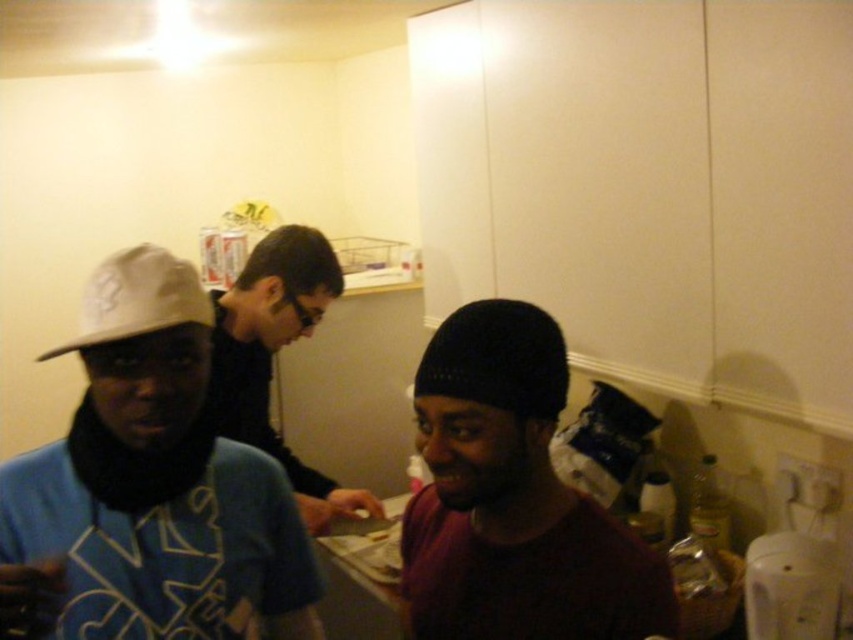
Is dark knit cap at center smaller than black matte shirt at center?

Yes.

The image size is (853, 640). What do you see at coordinates (512, 499) in the screenshot? I see `dark knit cap at center` at bounding box center [512, 499].

Locate an element on the screen. The image size is (853, 640). dark knit cap at center is located at coordinates (512, 499).

Is dark knit cap at center positioned behind white matte baseball cap at upper left?

No, it is in front of white matte baseball cap at upper left.

Based on the photo, can you confirm if dark knit cap at center is bigger than white matte baseball cap at upper left?

Yes, dark knit cap at center is bigger than white matte baseball cap at upper left.

Who is more distant from viewer, (544, 496) or (83, 307)?

The point (544, 496) is more distant.

Find the location of a particular element. dark knit cap at center is located at coordinates (512, 499).

Who is shorter, white matte cap at upper left or black knit cap at center?

black knit cap at center is shorter.

Which of these two, white matte cap at upper left or black knit cap at center, stands taller?

With more height is white matte cap at upper left.

At what (x,y) coordinates should I click in order to perform the action: click on white matte cap at upper left. Please return your answer as a coordinate pair (x, y). Looking at the image, I should click on (164, 548).

This screenshot has width=853, height=640. Find the location of `white matte cap at upper left`. white matte cap at upper left is located at coordinates (164, 548).